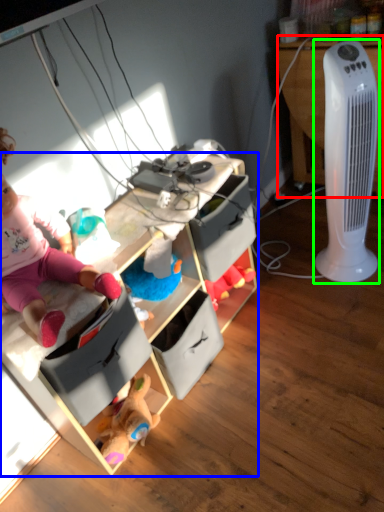
Question: Which object is the closest to the desk (highlighted by a red box)? Choose among these: cabinetry (highlighted by a blue box) or home appliance (highlighted by a green box).

Choices:
 (A) cabinetry
 (B) home appliance

Answer: (B)